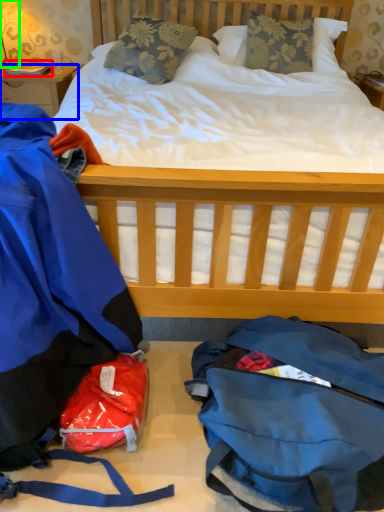
Question: Considering the real-world distances, which object is closest to book (highlighted by a red box)? desk (highlighted by a blue box) or lamp (highlighted by a green box).

Choices:
 (A) desk
 (B) lamp

Answer: (A)